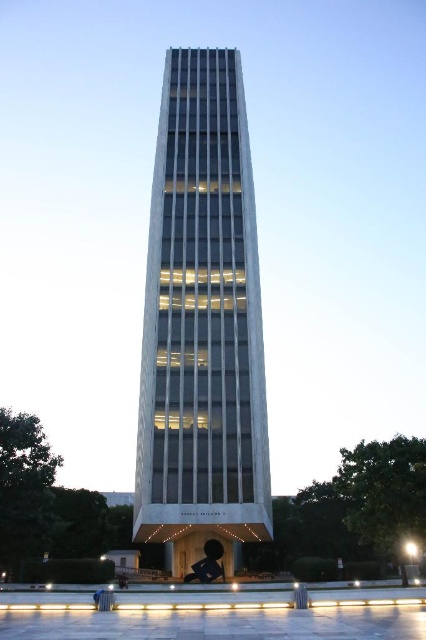
You are standing in the plaza in front of the white glass tower at center. You want to take a photo of the tower from a distance that is exactly 40 meters away. Is the current distance you are standing at sufficient to achieve this?

The white glass tower at center is currently 39.08 meters away from you. Since 39.08 meters is slightly less than 40 meters, you need to move back approximately 0.92 meters to reach the desired distance of 40 meters for your photo.

You are an architect designing a new sculpture to place between the white glass tower at center and the black glossy statue at center. The sculpture must be narrower than both existing objects. Which object should you use as the maximum width reference for your design?

The sculpture must be narrower than both the white glass tower at center and the black glossy statue at center. Since the white glass tower at center is wider than the black glossy statue at center, you should use the black glossy statue at center as the maximum width reference to ensure the new sculpture is narrower than both.

You are standing in the plaza and want to take a photo of both the white glass tower at center and the black glossy statue at center. Which object should you position closer to the camera to include both in the frame?

To include both the white glass tower at center and the black glossy statue at center in the frame, position the camera closer to the black glossy statue at center since the white glass tower at center is on its left side, allowing both to be captured within the same shot.